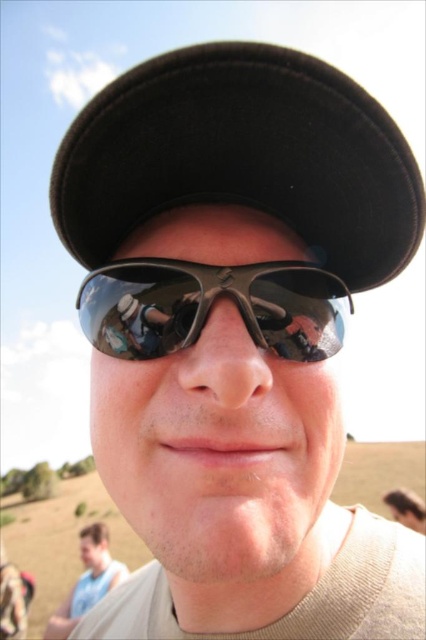
Question: Does black felt baseball hat at upper center have a smaller size compared to light blue shirt at lower left?

Choices:
 (A) yes
 (B) no

Answer: (A)

Question: In this image, where is shiny black goggles at center located relative to light blue shirt at lower left?

Choices:
 (A) below
 (B) above

Answer: (B)

Question: Which point appears closest to the camera in this image?

Choices:
 (A) (420, 188)
 (B) (78, 291)
 (C) (115, 580)

Answer: (A)

Question: Estimate the real-world distances between objects in this image. Which object is farther from the black felt baseball hat at upper center?

Choices:
 (A) shiny black goggles at center
 (B) light blue shirt at lower left

Answer: (B)

Question: Among these objects, which one is nearest to the camera?

Choices:
 (A) shiny black goggles at center
 (B) light blue shirt at lower left

Answer: (A)

Question: Is shiny black goggles at center closer to camera compared to light blue shirt at lower left?

Choices:
 (A) yes
 (B) no

Answer: (A)